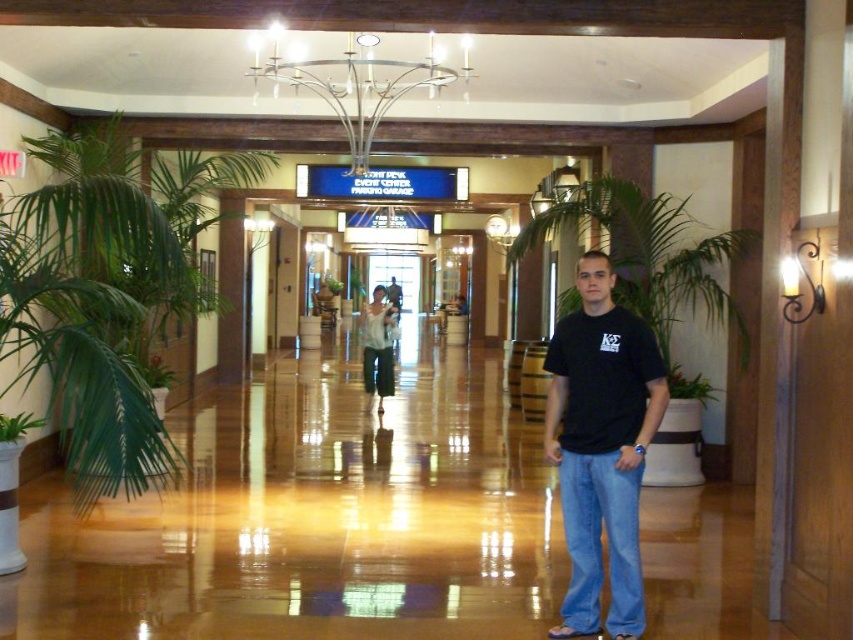
Question: Does green leafy plant at left appear on the right side of green leafy plant at lower left?

Choices:
 (A) yes
 (B) no

Answer: (A)

Question: Which point is farther to the camera?

Choices:
 (A) (3, 417)
 (B) (566, 310)
 (C) (573, 534)

Answer: (B)

Question: Can you confirm if green leafy plant at center is positioned below green leafy plant at lower left?

Choices:
 (A) no
 (B) yes

Answer: (A)

Question: Based on their relative distances, which object is farther from the white cotton shirt at center?

Choices:
 (A) matte black shirt at center
 (B) green leafy plant at left
 (C) silver metallic chandelier at upper center
 (D) black cotton t-shirt at center

Answer: (D)

Question: Considering the real-world distances, which object is closest to the black cotton t-shirt at center?

Choices:
 (A) green leafy plant at lower left
 (B) white cotton shirt at center
 (C) matte black shirt at center

Answer: (A)

Question: Is black cotton t-shirt at center positioned before green leafy plant at center?

Choices:
 (A) yes
 (B) no

Answer: (A)